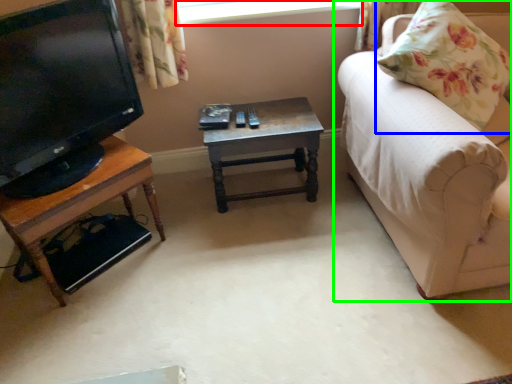
Question: Estimate the real-world distances between objects in this image. Which object is closer to window screen (highlighted by a red box), pillow (highlighted by a blue box) or studio couch (highlighted by a green box)?

Choices:
 (A) pillow
 (B) studio couch

Answer: (A)